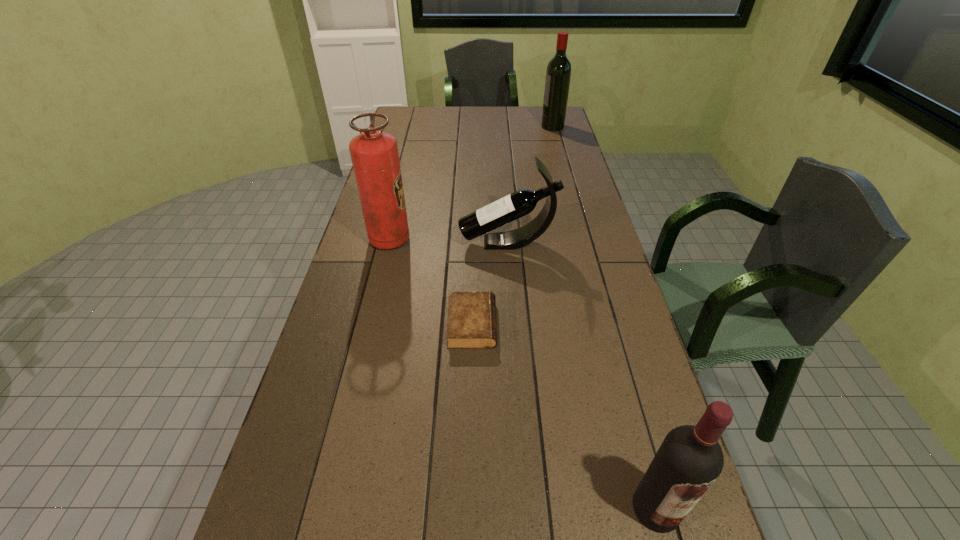
At what (x,y) coordinates should I click in order to perform the action: click on vacant space at the right edge of the desktop. Please return your answer as a coordinate pair (x, y). Looking at the image, I should click on (550, 140).

Locate an element on the screen. free space at the far right corner of the desktop is located at coordinates (538, 122).

Where is `free spot between the nearest wine bottle and the leftmost object`? The width and height of the screenshot is (960, 540). free spot between the nearest wine bottle and the leftmost object is located at coordinates (523, 374).

Where is `free space between the second nearest object and the nearest object`? The image size is (960, 540). free space between the second nearest object and the nearest object is located at coordinates (564, 416).

This screenshot has height=540, width=960. I want to click on free point between the shortest object and the shortest wine bottle, so click(490, 284).

At what (x,y) coordinates should I click in order to perform the action: click on free spot between the farthest wine bottle and the nearest object. Please return your answer as a coordinate pair (x, y). Looking at the image, I should click on (605, 317).

At what (x,y) coordinates should I click in order to perform the action: click on vacant area between the second shortest object and the diary. Please return your answer as a coordinate pair (x, y). Looking at the image, I should click on (490, 284).

The width and height of the screenshot is (960, 540). I want to click on free space between the nearest wine bottle and the diary, so click(x=564, y=416).

Image resolution: width=960 pixels, height=540 pixels. Find the location of `free space between the leftmost object and the shortest object`. free space between the leftmost object and the shortest object is located at coordinates (431, 282).

Identify the location of free space between the leftmost object and the farthest wine bottle. (471, 183).